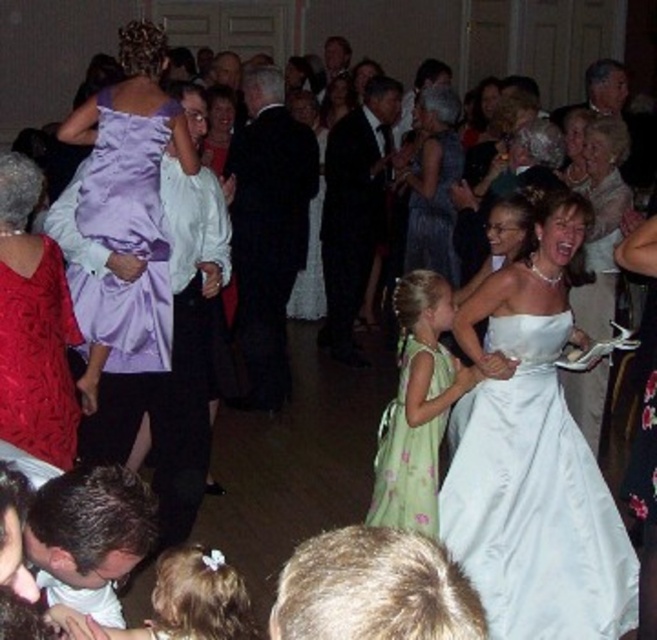
Question: In this image, where is satin dress at left located relative to black satin suit at center?

Choices:
 (A) above
 (B) below

Answer: (B)

Question: Is satin dress at left to the left of green floral dress at center from the viewer's perspective?

Choices:
 (A) no
 (B) yes

Answer: (B)

Question: Can you confirm if white satin dress at center is smaller than satin dress at left?

Choices:
 (A) yes
 (B) no

Answer: (B)

Question: Which is nearer to the smooth black suit at center?

Choices:
 (A) white satin dress at center
 (B) white satin dress at right
 (C) satin dress at left
 (D) green floral dress at center

Answer: (B)

Question: Among these objects, which one is nearest to the camera?

Choices:
 (A) green floral fabric dress at center
 (B) pastel green floral dress at lower center
 (C) silvery metallic dress at center

Answer: (B)

Question: Which point appears closest to the camera in this image?

Choices:
 (A) (296, 612)
 (B) (41, 410)
 (C) (263, 122)

Answer: (A)